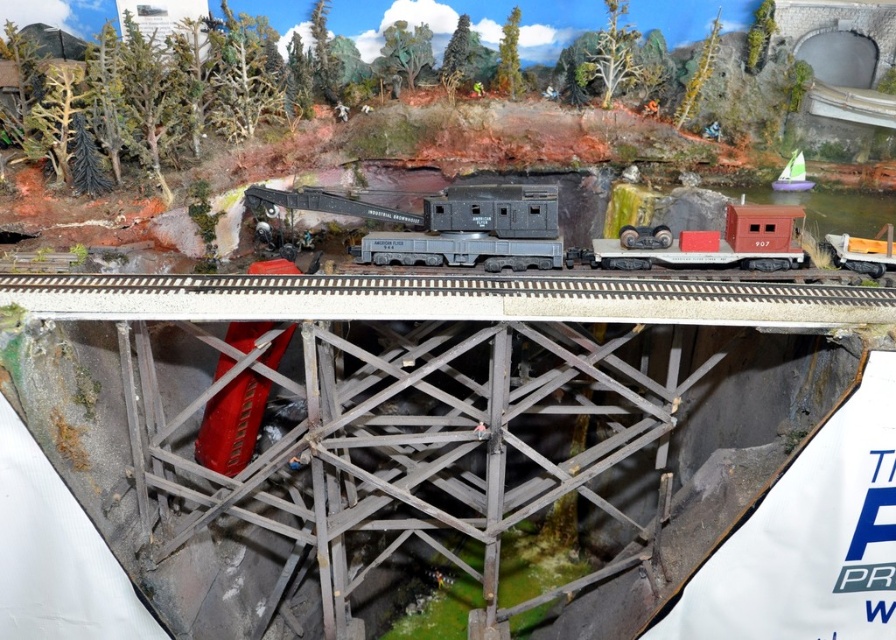
Can you confirm if smooth gray train track at center is positioned below matte black locomotive at center?

Indeed, smooth gray train track at center is positioned under matte black locomotive at center.

Who is more forward, (863, 307) or (833, 244)?

Point (863, 307) is more forward.

Find the location of `smooth gray train track at center`. smooth gray train track at center is located at coordinates (445, 298).